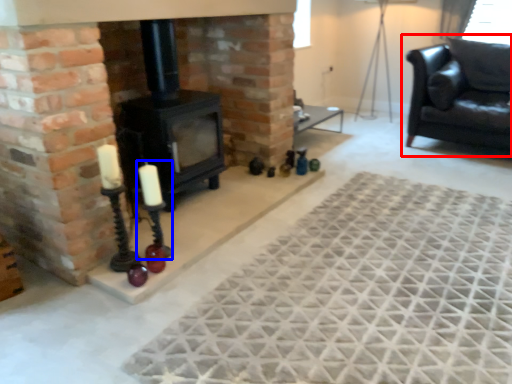
Question: Which point is closer to the camera, studio couch (highlighted by a red box) or candle holder (highlighted by a blue box)?

Choices:
 (A) studio couch
 (B) candle holder

Answer: (B)